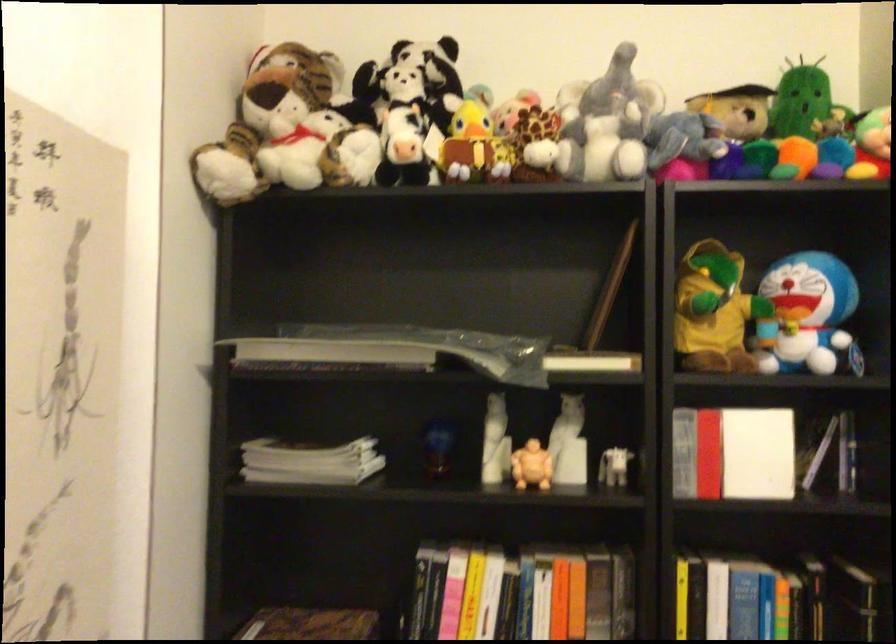
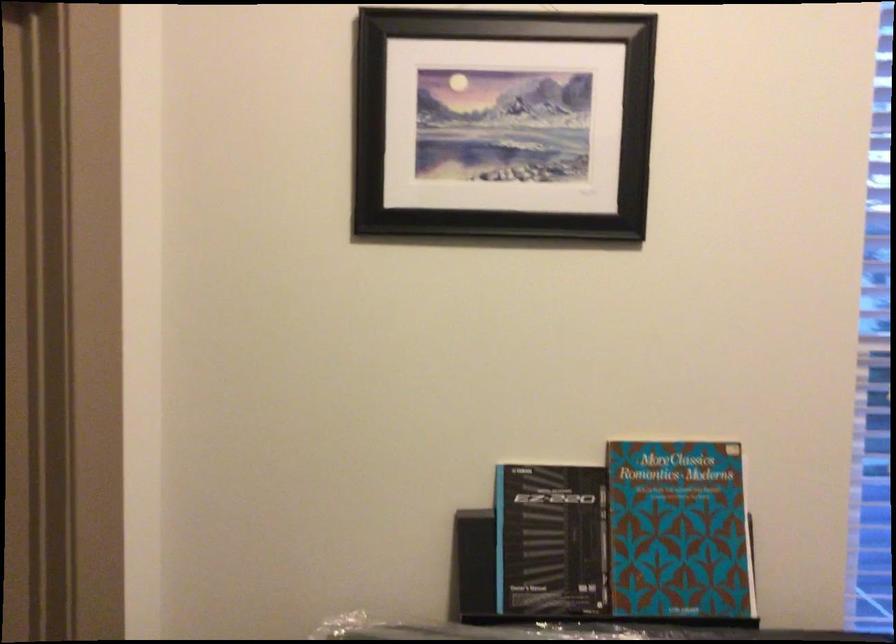
Question: How did the camera likely rotate?

Choices:
 (A) Left
 (B) Right
 (C) Up
 (D) Down

Answer: (B)